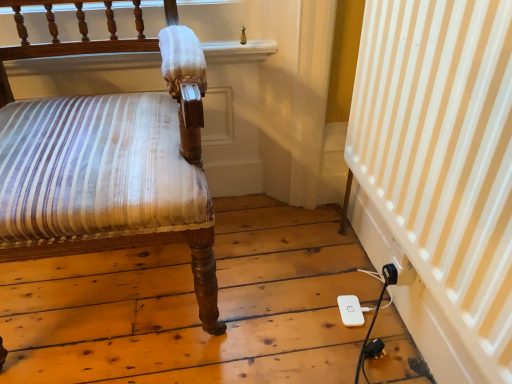
Question: Is matte brown wood chair at left positioned behind white plastic ipod at lower right?

Choices:
 (A) no
 (B) yes

Answer: (A)

Question: Can you confirm if matte brown wood chair at left is taller than white plastic ipod at lower right?

Choices:
 (A) yes
 (B) no

Answer: (A)

Question: Is matte brown wood chair at left positioned with its back to white plastic ipod at lower right?

Choices:
 (A) no
 (B) yes

Answer: (A)

Question: Is matte brown wood chair at left not within white plastic ipod at lower right?

Choices:
 (A) yes
 (B) no

Answer: (A)

Question: From a real-world perspective, does matte brown wood chair at left sit lower than white plastic ipod at lower right?

Choices:
 (A) no
 (B) yes

Answer: (A)

Question: Is matte brown wood chair at left smaller than white plastic ipod at lower right?

Choices:
 (A) yes
 (B) no

Answer: (B)

Question: Does white plastic ipod at lower right have a lesser width compared to white striped curtain at lower right?

Choices:
 (A) no
 (B) yes

Answer: (B)

Question: Can you confirm if white plastic ipod at lower right is smaller than white striped curtain at lower right?

Choices:
 (A) yes
 (B) no

Answer: (A)

Question: Are white plastic ipod at lower right and white striped curtain at lower right far apart?

Choices:
 (A) yes
 (B) no

Answer: (B)

Question: Is white plastic ipod at lower right wider than white striped curtain at lower right?

Choices:
 (A) yes
 (B) no

Answer: (B)

Question: From the image's perspective, would you say white plastic ipod at lower right is shown under white striped curtain at lower right?

Choices:
 (A) yes
 (B) no

Answer: (A)

Question: Is white plastic ipod at lower right facing away from white striped curtain at lower right?

Choices:
 (A) no
 (B) yes

Answer: (B)

Question: Is matte brown wood chair at left beside white striped curtain at lower right?

Choices:
 (A) yes
 (B) no

Answer: (B)